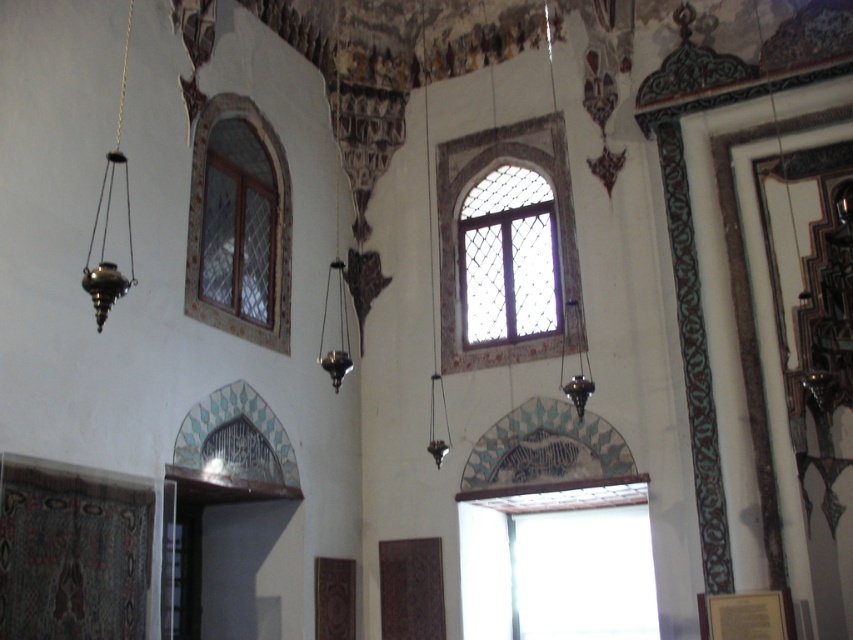
You are standing at point (239, 225) in the historical building. What object are you directly facing?

You are directly facing the clear glass window at upper center located at point (239, 225).